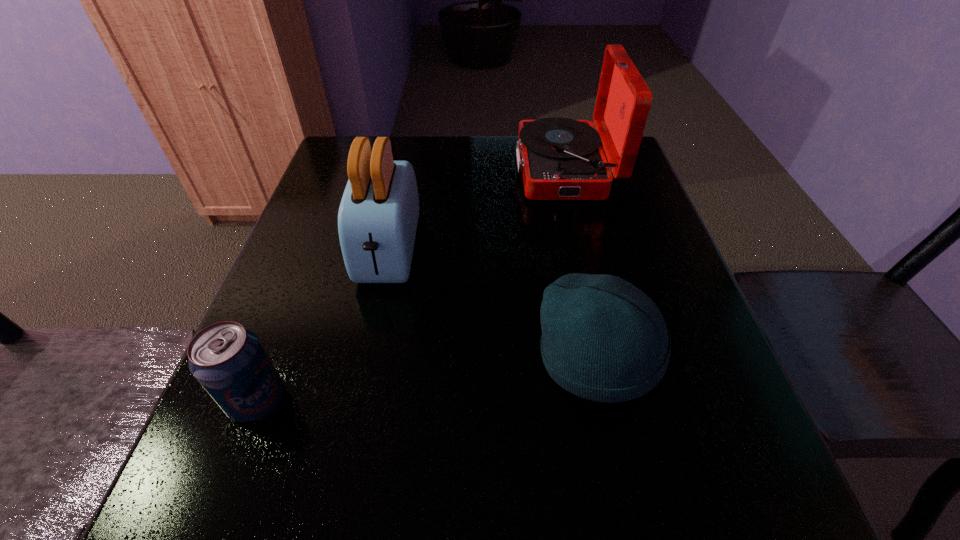
I want to click on vacant space located on the back of the leftmost object, so click(291, 314).

This screenshot has width=960, height=540. I want to click on object positioned at the far edge, so click(x=560, y=159).

You are a GUI agent. You are given a task and a screenshot of the screen. Output one action in this format:
    pyautogui.click(x=<x>, y=<y>)
    Task: Click on the toaster that is at the left edge
    Image resolution: width=960 pixels, height=540 pixels.
    Given the screenshot: What is the action you would take?
    pyautogui.click(x=378, y=215)

Identify the location of pop soda at the left edge. The image size is (960, 540). (228, 360).

The image size is (960, 540). What are the coordinates of `phonograph_record present at the right edge` in the screenshot? It's located at (560, 159).

Where is `beanie at the right edge`? The height and width of the screenshot is (540, 960). beanie at the right edge is located at coordinates pos(603,339).

You are a GUI agent. You are given a task and a screenshot of the screen. Output one action in this format:
    pyautogui.click(x=<x>, y=<y>)
    Task: Click on the object present at the far right corner
    The width and height of the screenshot is (960, 540).
    Given the screenshot: What is the action you would take?
    pyautogui.click(x=560, y=159)

Locate an element on the screen. Image resolution: width=960 pixels, height=540 pixels. free location at the far edge of the desktop is located at coordinates (432, 148).

You are a GUI agent. You are given a task and a screenshot of the screen. Output one action in this format:
    pyautogui.click(x=<x>, y=<y>)
    Task: Click on the vacant space at the left edge
    This screenshot has height=540, width=960.
    Given the screenshot: What is the action you would take?
    pyautogui.click(x=260, y=421)

In the image, there is a desktop. Where is `free space at the right edge`? This screenshot has height=540, width=960. free space at the right edge is located at coordinates (620, 251).